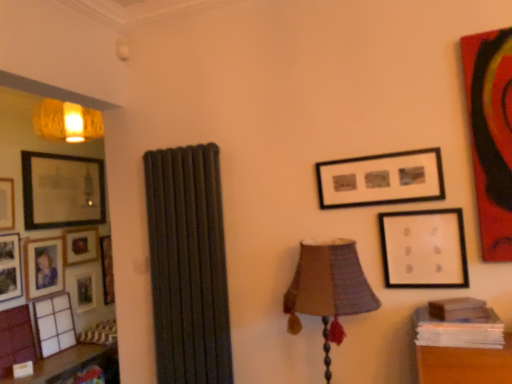
Question: Is wooden table at left bigger than wooden photo frame at left, which ranks as the 3th picture frame in front-to-back order?

Choices:
 (A) no
 (B) yes

Answer: (B)

Question: Is wooden table at left thinner than wooden photo frame at left, which ranks as the 3th picture frame in front-to-back order?

Choices:
 (A) no
 (B) yes

Answer: (A)

Question: From the image's perspective, is wooden table at left beneath wooden photo frame at left, placed as the 2th picture frame when sorted from left to right?

Choices:
 (A) yes
 (B) no

Answer: (A)

Question: Does wooden table at left lie behind wooden photo frame at left, which ranks as the 3th picture frame in front-to-back order?

Choices:
 (A) no
 (B) yes

Answer: (A)

Question: Considering the relative positions of wooden table at left and wooden photo frame at left, placed as the 2th picture frame when sorted from left to right, in the image provided, is wooden table at left to the left of wooden photo frame at left, placed as the 2th picture frame when sorted from left to right, from the viewer's perspective?

Choices:
 (A) no
 (B) yes

Answer: (A)

Question: From a real-world perspective, relative to matte black picture frame at upper right, arranged as the seventh picture frame when viewed from the back, is white matte picture frame at upper right, which is the 1th picture frame from right to left, vertically above or below?

Choices:
 (A) above
 (B) below

Answer: (B)

Question: In terms of height, does white matte picture frame at upper right, the eighth picture frame viewed from the back, look taller or shorter compared to matte black picture frame at upper right, which ranks as the 2th picture frame in right-to-left order?

Choices:
 (A) tall
 (B) short

Answer: (A)

Question: Based on their sizes in the image, would you say white matte picture frame at upper right, which is the 1th picture frame from right to left, is bigger or smaller than matte black picture frame at upper right, which ranks as the 2th picture frame in right-to-left order?

Choices:
 (A) small
 (B) big

Answer: (A)

Question: Is white matte picture frame at upper right, the 1th picture frame from the front, in front of or behind matte black picture frame at upper right, which is the 7th picture frame in left-to-right order, in the image?

Choices:
 (A) behind
 (B) front

Answer: (B)

Question: Is matte glass picture frame at left, placed as the sixth picture frame when sorted from right to left, in front of or behind matte black picture frame at left, which is the 5th picture frame in right-to-left order, in the image?

Choices:
 (A) front
 (B) behind

Answer: (B)

Question: Considering the positions of point (30, 210) and point (47, 256), is point (30, 210) closer or farther from the camera than point (47, 256)?

Choices:
 (A) farther
 (B) closer

Answer: (B)

Question: Is matte glass picture frame at left, the 3th picture frame viewed from the back, inside the boundaries of matte black picture frame at left, the 4th picture frame viewed from the back, or outside?

Choices:
 (A) outside
 (B) inside

Answer: (A)

Question: Considering the positions of matte glass picture frame at left, the sixth picture frame in the front-to-back sequence, and matte black picture frame at left, which is the 5th picture frame in right-to-left order, in the image, is matte glass picture frame at left, the sixth picture frame in the front-to-back sequence, bigger or smaller than matte black picture frame at left, which is the 5th picture frame in right-to-left order,?

Choices:
 (A) small
 (B) big

Answer: (B)

Question: Which is correct: wooden table at left is inside matte black picture frame at left, the fifth picture frame from the front, or outside of it?

Choices:
 (A) outside
 (B) inside

Answer: (A)

Question: In terms of height, does wooden table at left look taller or shorter compared to matte black picture frame at left, the fifth picture frame from the front?

Choices:
 (A) tall
 (B) short

Answer: (B)